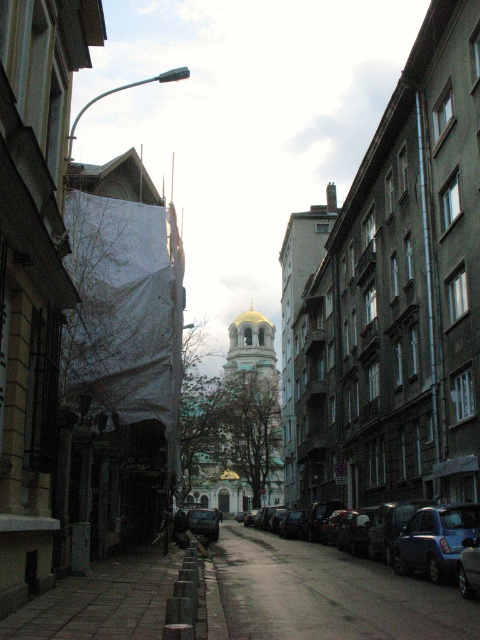
Question: Which point is farther to the camera?

Choices:
 (A) dark asphalt pavement at center
 (B) gray concrete pavement at lower center
 (C) shiny black car at center

Answer: (C)

Question: Is the position of gray concrete pavement at lower center less distant than that of blue metallic car at lower right?

Choices:
 (A) no
 (B) yes

Answer: (B)

Question: Which object is positioned farthest from the blue metallic car at lower right?

Choices:
 (A) dark asphalt pavement at center
 (B) shiny black car at center
 (C) gray concrete pavement at lower center
 (D) metallic blue car at center

Answer: (B)

Question: Which point is farther to the camera?

Choices:
 (A) (140, 570)
 (B) (210, 538)
 (C) (462, 544)
 (D) (410, 545)

Answer: (B)

Question: Can you confirm if dark asphalt pavement at center is smaller than blue metallic car at lower right?

Choices:
 (A) yes
 (B) no

Answer: (B)

Question: Is gray concrete pavement at lower center to the left of blue metallic car at lower right from the viewer's perspective?

Choices:
 (A) no
 (B) yes

Answer: (B)